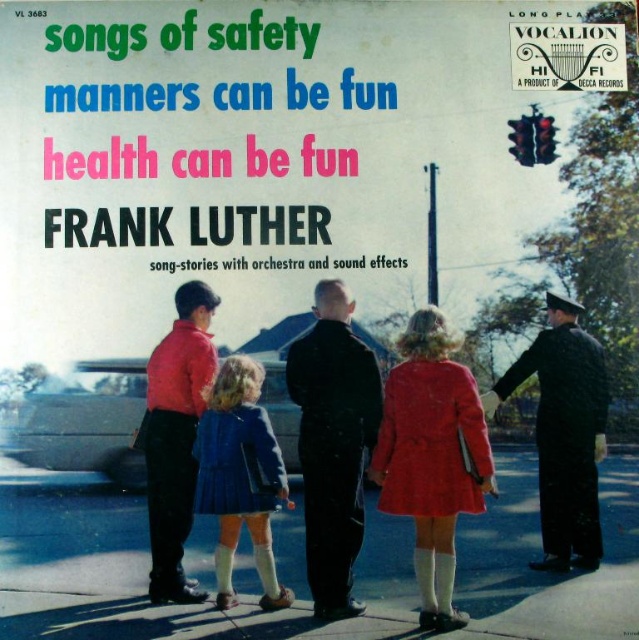
Question: Which is nearer to the matte black uniform at center?

Choices:
 (A) blue pleated skirt at center
 (B) red paper sign at upper right

Answer: (A)

Question: Is black uniform at right closer to the viewer compared to matte red shirt at center?

Choices:
 (A) no
 (B) yes

Answer: (A)

Question: Which point is closer to the camera?

Choices:
 (A) blue pleated skirt at center
 (B) red paper sign at upper right
 (C) matte black uniform at center

Answer: (C)

Question: Which point appears closest to the camera in this image?

Choices:
 (A) (171, 472)
 (B) (204, 392)

Answer: (A)

Question: In this image, where is black uniform at right located relative to matte red shirt at center?

Choices:
 (A) below
 (B) above

Answer: (B)

Question: Can you confirm if black uniform at right is bigger than matte red shirt at center?

Choices:
 (A) yes
 (B) no

Answer: (A)